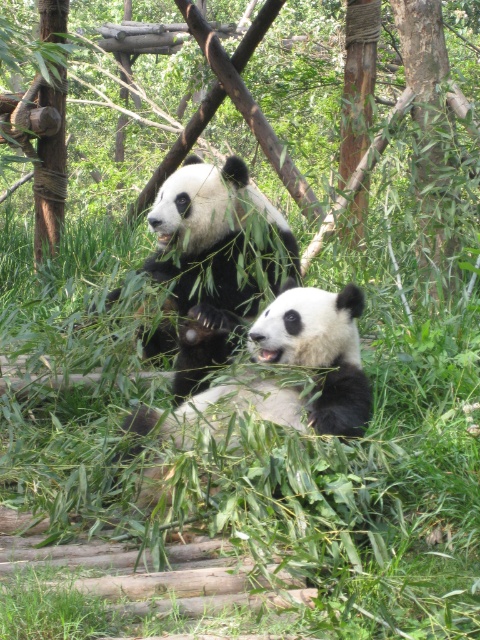
You are a zookeeper observing two pandas in their enclosure. You see the black fuzzy panda at upper center and the black fuzzy panda at center. Which panda is positioned to the left of the other?

The black fuzzy panda at upper center is to the left of the black fuzzy panda at center.

You are a zookeeper who needs to place a feeding tray between the green leafy tree at upper center and the black fuzzy panda at upper center. The feeding tray requires a minimum of 2 meters of space to be placed safely. Can you fit the feeding tray between them?

The green leafy tree at upper center and the black fuzzy panda at upper center are 2.45 meters apart from each other, so yes, the feeding tray can be placed between them since the distance is more than the required 2 meters.

You are a zookeeper observing two pandas in their enclosure. You notice a black fuzzy panda at upper center and a black fuzzy panda at center. Which panda has a greater width?

The black fuzzy panda at upper center has a greater width than the black fuzzy panda at center.